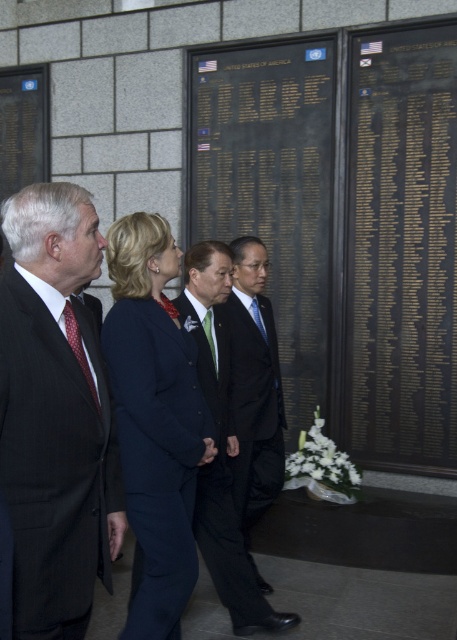
Question: Which point is closer to the camera taking this photo?

Choices:
 (A) (254, 620)
 (B) (258, 308)
 (C) (164, 356)
 (D) (70, 316)

Answer: (D)

Question: Based on their relative distances, which object is nearer to the dark green textured suit at center?

Choices:
 (A) polka dot silk tie at left
 (B) green silk tie at center
 (C) navy blue suit at center
 (D) blue silk tie at center

Answer: (B)

Question: Which object appears farthest from the camera in this image?

Choices:
 (A) polka dot silk tie at left
 (B) dark green textured suit at center
 (C) black glossy suit at center

Answer: (C)

Question: Does dark gray suit at left have a lesser width compared to black glossy suit at center?

Choices:
 (A) yes
 (B) no

Answer: (A)

Question: Is black glossy suit at center thinner than polka dot silk tie at left?

Choices:
 (A) yes
 (B) no

Answer: (B)

Question: Is navy blue suit at center below polka dot silk tie at left?

Choices:
 (A) no
 (B) yes

Answer: (B)